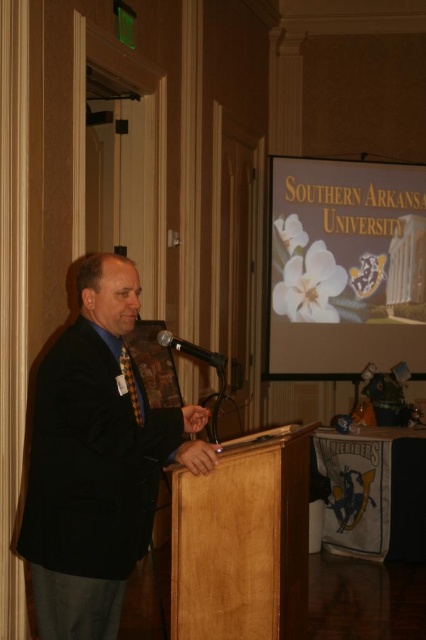
Question: Estimate the real-world distances between objects in this image. Which object is farther from the white matte flower at upper center?

Choices:
 (A) black metallic microphone at center
 (B) multicolored woven tie at center

Answer: (B)

Question: Where is black textured suit at center located in relation to multicolored woven tie at center in the image?

Choices:
 (A) right
 (B) left

Answer: (A)

Question: Which point is closer to the camera?

Choices:
 (A) black textured suit at center
 (B) wooden podium at center
 (C) white matte flower at upper center
 (D) multicolored woven tie at center

Answer: (A)

Question: Can you confirm if black metallic microphone at center is bigger than multicolored woven tie at center?

Choices:
 (A) no
 (B) yes

Answer: (B)

Question: From the image, what is the correct spatial relationship of black textured suit at center in relation to black metallic microphone at center?

Choices:
 (A) below
 (B) above

Answer: (A)

Question: Which object is closer to the camera taking this photo?

Choices:
 (A) multicolored woven tie at center
 (B) black metallic microphone at center

Answer: (A)